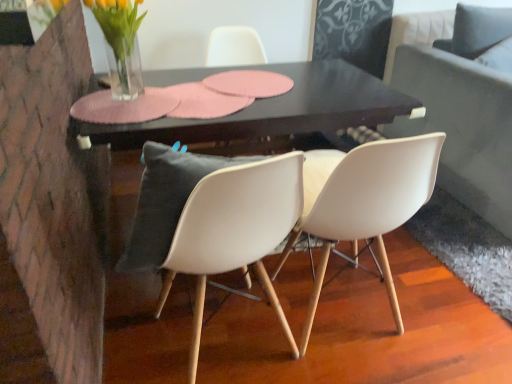
Image resolution: width=512 pixels, height=384 pixels. I want to click on vacant space situated above black glossy table at center (from a real-world perspective), so click(203, 87).